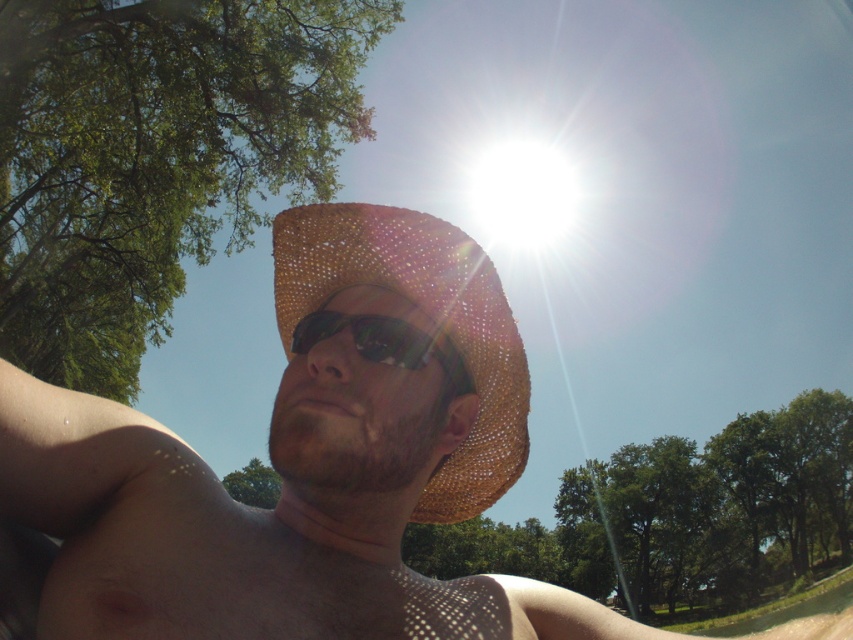
You are a photographer trying to capture the perfect shot of the person in the scene. You notice the brown straw hat at center and the sunglasses at center. Which object should you focus on first if you want to follow the rule of thirds composition technique, which suggests placing important elements along imaginary lines that divide the image into thirds?

The rule of thirds composition technique suggests placing important elements along imaginary lines that divide the image into thirds. Since the brown straw hat at center is to the right of sunglasses at center, focusing on the sunglasses at center first would align better with the rule of thirds as it is positioned closer to the left third line, creating a more balanced composition.

You are a photographer trying to capture a closeup of the sunglasses at center. The braided straw cowboy hat at center is blocking your view. Can you move the hat to the side to get a clear shot of the sunglasses?

The braided straw cowboy hat at center is further to the viewer than sunglasses at center, so moving the hat to the side would allow you to see the sunglasses at center clearly.

You are a photographer planning to take a closeup shot of the sunglasses at center and the braided straw cowboy hat at center. Given their sizes, which object should you zoom in more on to ensure both fit in the frame?

The braided straw cowboy hat at center is wider than the sunglasses at center. To ensure both fit in the frame, you should zoom out slightly so that the wider braided straw cowboy hat at center is fully visible, allowing the smaller sunglasses at center to also be included.